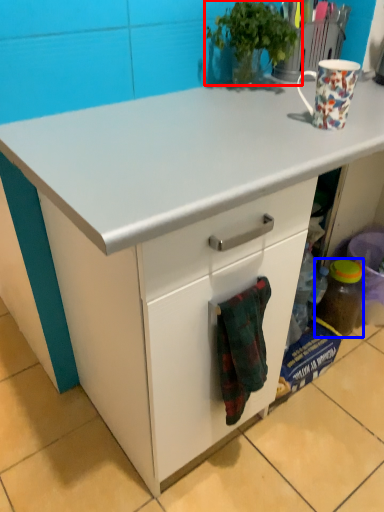
Question: Among these objects, which one is nearest to the camera, houseplant (highlighted by a red box) or bottle (highlighted by a blue box)?

Choices:
 (A) houseplant
 (B) bottle

Answer: (A)